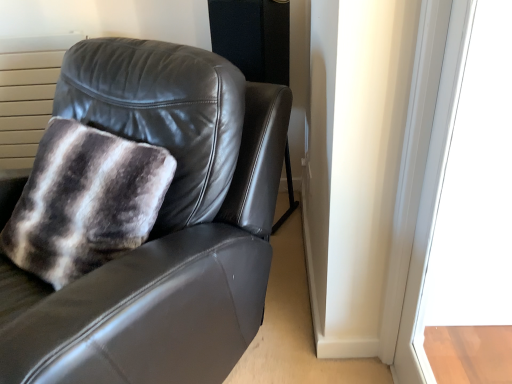
Question: Can you confirm if transparent glass door at upper right is bigger than matte black leather chair at upper left?

Choices:
 (A) yes
 (B) no

Answer: (B)

Question: Does transparent glass door at upper right appear on the right side of matte black leather chair at upper left?

Choices:
 (A) yes
 (B) no

Answer: (A)

Question: From the image's perspective, would you say transparent glass door at upper right is positioned over matte black leather chair at upper left?

Choices:
 (A) yes
 (B) no

Answer: (B)

Question: Considering the relative sizes of transparent glass door at upper right and matte black leather chair at upper left in the image provided, is transparent glass door at upper right wider than matte black leather chair at upper left?

Choices:
 (A) no
 (B) yes

Answer: (A)

Question: Is transparent glass door at upper right taller than matte black leather chair at upper left?

Choices:
 (A) no
 (B) yes

Answer: (B)

Question: Is transparent glass door at upper right smaller than matte black leather chair at upper left?

Choices:
 (A) yes
 (B) no

Answer: (A)

Question: Is matte black leather chair at upper left bigger than transparent glass door at upper right?

Choices:
 (A) no
 (B) yes

Answer: (B)

Question: Considering the relative sizes of matte black leather chair at upper left and transparent glass door at upper right in the image provided, is matte black leather chair at upper left shorter than transparent glass door at upper right?

Choices:
 (A) yes
 (B) no

Answer: (A)

Question: Is matte black leather chair at upper left positioned behind transparent glass door at upper right?

Choices:
 (A) no
 (B) yes

Answer: (B)

Question: Is matte black leather chair at upper left oriented towards transparent glass door at upper right?

Choices:
 (A) no
 (B) yes

Answer: (A)

Question: Is matte black leather chair at upper left positioned in front of transparent glass door at upper right?

Choices:
 (A) no
 (B) yes

Answer: (A)

Question: From the image's perspective, is matte black leather chair at upper left below transparent glass door at upper right?

Choices:
 (A) no
 (B) yes

Answer: (A)

Question: From the image's perspective, is transparent glass door at upper right located above or below matte black leather chair at upper left?

Choices:
 (A) below
 (B) above

Answer: (A)